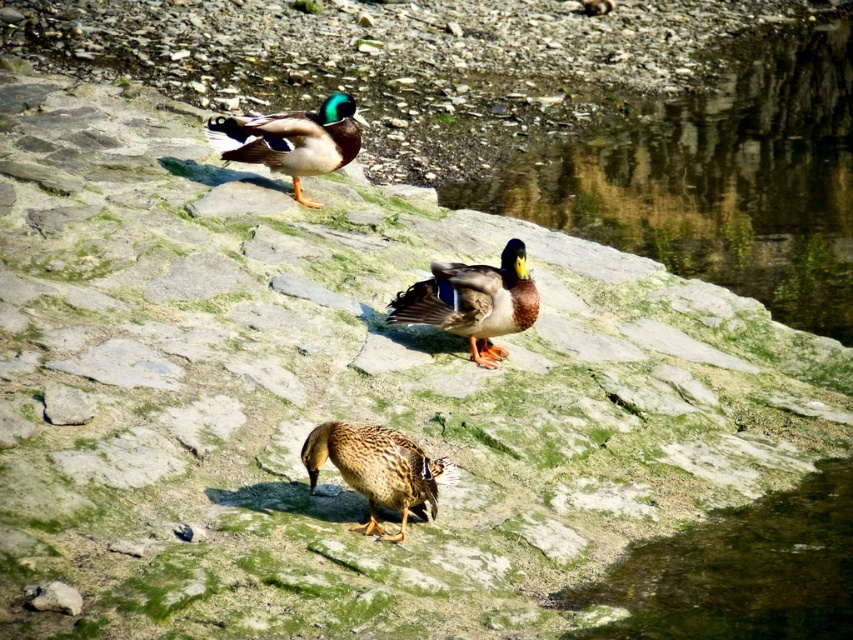
Question: Is shiny brown duck at center positioned before shiny green and brown duck at upper center?

Choices:
 (A) no
 (B) yes

Answer: (B)

Question: Which point appears farthest from the camera in this image?

Choices:
 (A) (416, 474)
 (B) (311, 129)
 (C) (437, 284)

Answer: (B)

Question: Which object is positioned farthest from the shiny brown duck at center?

Choices:
 (A) brown speckled feathers at center
 (B) shiny green and brown duck at upper center

Answer: (B)

Question: Among these objects, which one is nearest to the camera?

Choices:
 (A) shiny brown duck at center
 (B) brown speckled feathers at center
 (C) shiny green and brown duck at upper center

Answer: (B)

Question: Does shiny brown duck at center appear on the right side of shiny green and brown duck at upper center?

Choices:
 (A) no
 (B) yes

Answer: (B)

Question: Can you confirm if shiny brown duck at center is positioned to the left of shiny green and brown duck at upper center?

Choices:
 (A) yes
 (B) no

Answer: (B)